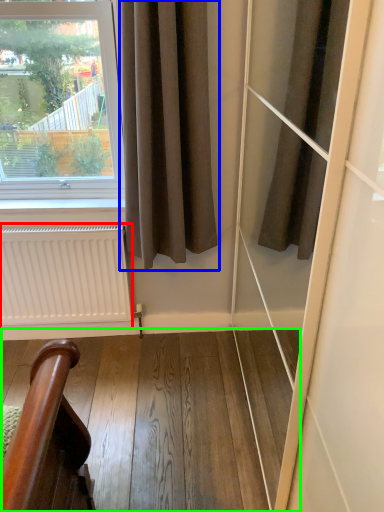
Question: Based on their relative distances, which object is nearer to radiator (highlighted by a red box)? Choose from curtain (highlighted by a blue box) and stairwell (highlighted by a green box).

Choices:
 (A) curtain
 (B) stairwell

Answer: (B)